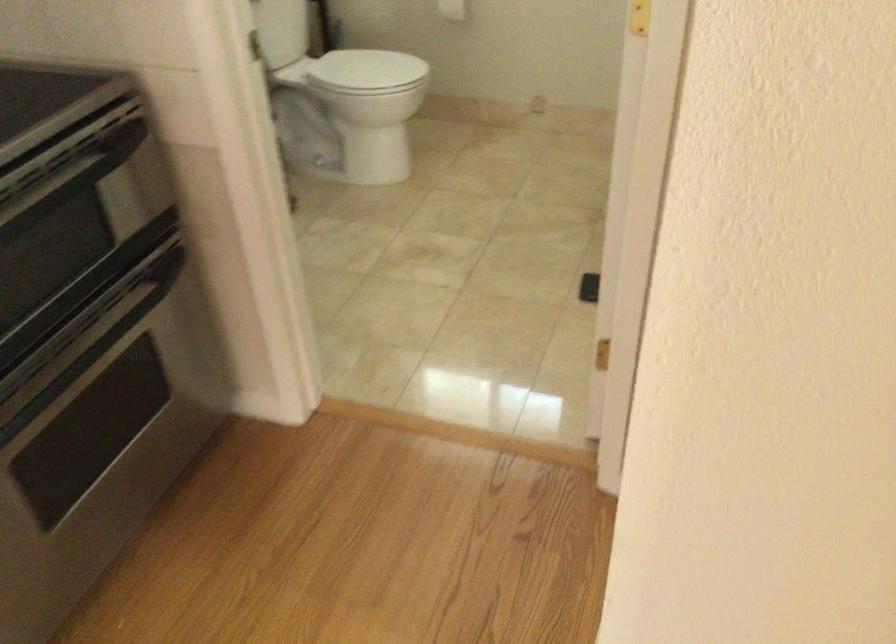
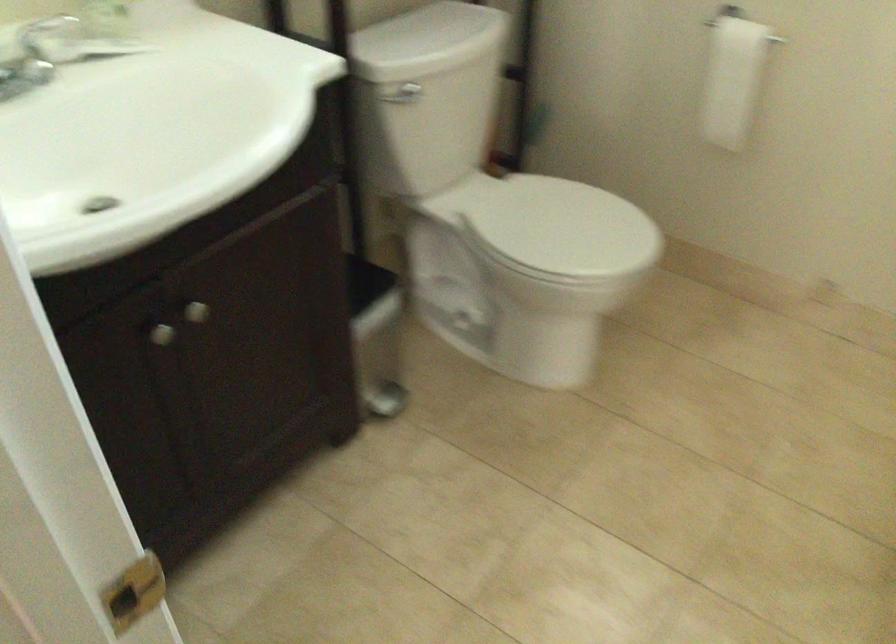
Locate, in the second image, the point that corresponds to point (376, 69) in the first image.

(564, 225)